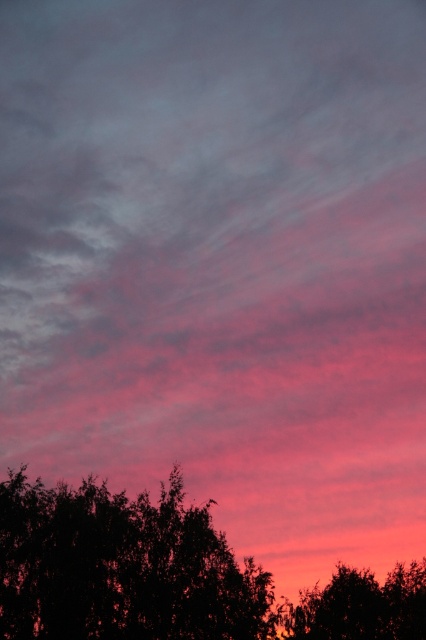
You are an astronomer analyzing the image. You notice a point at coordinates (120, 566). What object is located at that point?

The silhouette leafy tree at lower center is located at point (120, 566).

You are standing in front of the dramatic sky scene with silhouetted tree tops. You notice two points in the sky, one at point (230,620) and the other at point (405,634). Which point is closer to you?

Point (230,620) is closer to the camera than point (405,634).